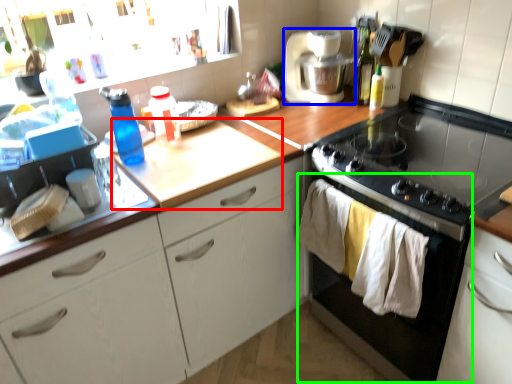
Question: Considering the real-world distances, which object is farthest from counter top (highlighted by a red box)? kitchen appliance (highlighted by a blue box) or oven (highlighted by a green box)?

Choices:
 (A) kitchen appliance
 (B) oven

Answer: (A)